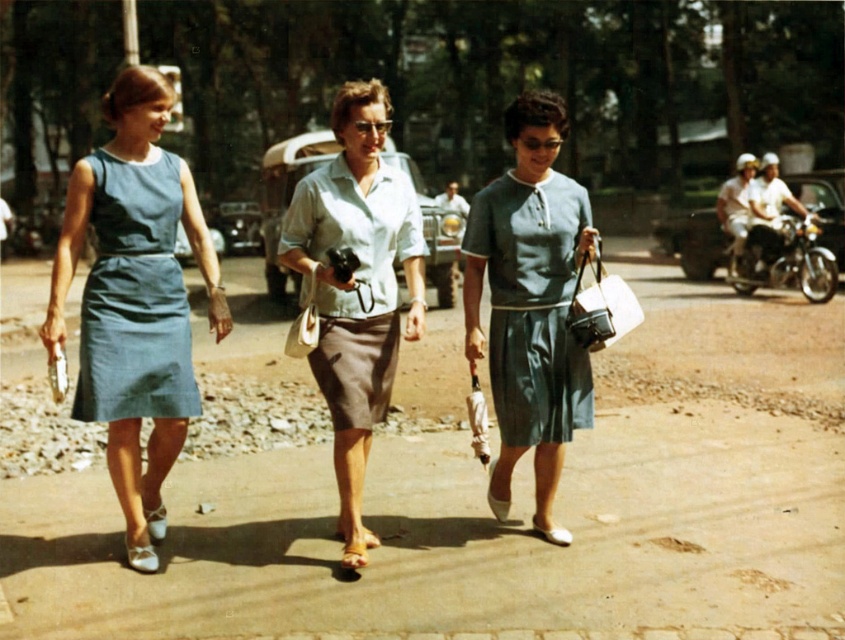
You are a photographer trying to capture a photo of the matte blue dress at left and the shiny chrome motorcycle at right. Since you want to include both in the frame, which object should you focus on first to ensure both are in focus?

The matte blue dress at left is smaller in width than the shiny chrome motorcycle at right, so you should focus on the shiny chrome motorcycle at right first to ensure both are in focus.

You are a photographer standing on the pathway. You want to take a photo of the matte blue dress at left and the shiny chrome motorcycle at right. Which object should you focus on first to ensure both are in the frame?

The matte blue dress at left is in front of the shiny chrome motorcycle at right, so you should focus on the matte blue dress at left first to ensure both are in the frame.